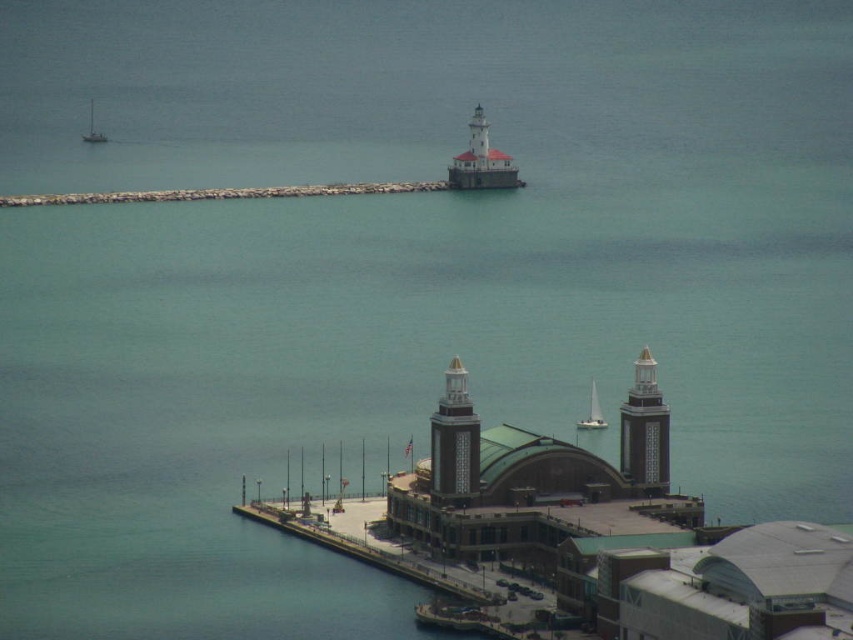
Can you confirm if smooth gray tower at center is shorter than white painted concrete lighthouse at upper center?

No, smooth gray tower at center is not shorter than white painted concrete lighthouse at upper center.

Consider the image. Is smooth gray tower at center to the right of white painted concrete lighthouse at upper center from the viewer's perspective?

Yes, smooth gray tower at center is to the right of white painted concrete lighthouse at upper center.

Does point (647, 476) lie in front of point (482, 157)?

No.

Locate an element on the screen. smooth gray tower at center is located at coordinates (643, 429).

Can you confirm if matte gray tower at center is taller than white painted concrete lighthouse at upper center?

Yes.

Is matte gray tower at center below white painted concrete lighthouse at upper center?

Indeed, matte gray tower at center is positioned under white painted concrete lighthouse at upper center.

Is point (466, 374) closer to viewer compared to point (485, 129)?

Yes, point (466, 374) is closer to viewer.

Locate an element on the screen. matte gray tower at center is located at coordinates (454, 442).

Is point (482, 148) positioned behind point (577, 426)?

Yes.

Is point (485, 163) closer to viewer compared to point (585, 417)?

Yes, it is.

At what (x,y) coordinates should I click in order to perform the action: click on white painted concrete lighthouse at upper center. Please return your answer as a coordinate pair (x, y). Looking at the image, I should click on (479, 134).